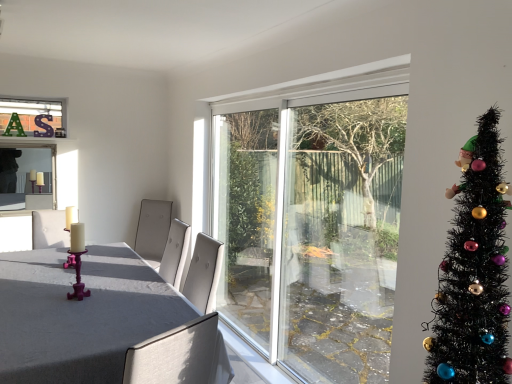
Question: Should I look upward or downward to see black artificial christmas tree at right?

Choices:
 (A) down
 (B) up

Answer: (A)

Question: From the image's perspective, is matte gray table at center located beneath white glossy candle at left?

Choices:
 (A) yes
 (B) no

Answer: (A)

Question: From a real-world perspective, is matte gray table at center on white glossy candle at left?

Choices:
 (A) yes
 (B) no

Answer: (B)

Question: Is matte gray table at center oriented towards white glossy candle at left?

Choices:
 (A) no
 (B) yes

Answer: (A)

Question: Is matte gray table at center not within white glossy candle at left?

Choices:
 (A) yes
 (B) no

Answer: (A)

Question: Is matte gray table at center with white glossy candle at left?

Choices:
 (A) no
 (B) yes

Answer: (A)

Question: From a real-world perspective, is matte gray table at center below white glossy candle at left?

Choices:
 (A) yes
 (B) no

Answer: (A)

Question: Does matte glass candlesticks at left have a greater height compared to black artificial christmas tree at right?

Choices:
 (A) yes
 (B) no

Answer: (B)

Question: Can you confirm if matte glass candlesticks at left is wider than black artificial christmas tree at right?

Choices:
 (A) yes
 (B) no

Answer: (B)

Question: From a real-world perspective, is matte glass candlesticks at left positioned over black artificial christmas tree at right based on gravity?

Choices:
 (A) yes
 (B) no

Answer: (B)

Question: Is matte glass candlesticks at left aimed at black artificial christmas tree at right?

Choices:
 (A) yes
 (B) no

Answer: (A)

Question: Is matte glass candlesticks at left directly adjacent to black artificial christmas tree at right?

Choices:
 (A) yes
 (B) no

Answer: (B)

Question: From the image's perspective, does matte glass candlesticks at left appear lower than black artificial christmas tree at right?

Choices:
 (A) no
 (B) yes

Answer: (A)

Question: Is black artificial christmas tree at right facing away from white glossy candle at left?

Choices:
 (A) yes
 (B) no

Answer: (B)